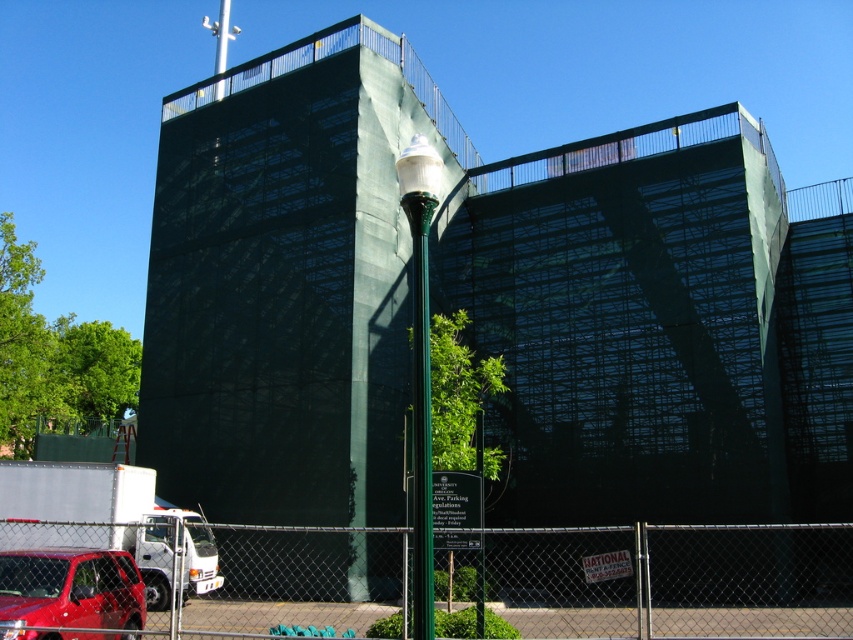
Question: Is metal chain-link fence at lower left to the right of shiny red suv at lower left from the viewer's perspective?

Choices:
 (A) yes
 (B) no

Answer: (A)

Question: Which of the following is the farthest from the observer?

Choices:
 (A) shiny red suv at lower left
 (B) metal chain-link fence at lower left

Answer: (B)

Question: Among these points, which one is nearest to the camera?

Choices:
 (A) (44, 609)
 (B) (518, 625)

Answer: (A)

Question: Does metal chain-link fence at lower left have a larger size compared to shiny red suv at lower left?

Choices:
 (A) no
 (B) yes

Answer: (B)

Question: Does metal chain-link fence at lower left have a larger size compared to shiny red suv at lower left?

Choices:
 (A) yes
 (B) no

Answer: (A)